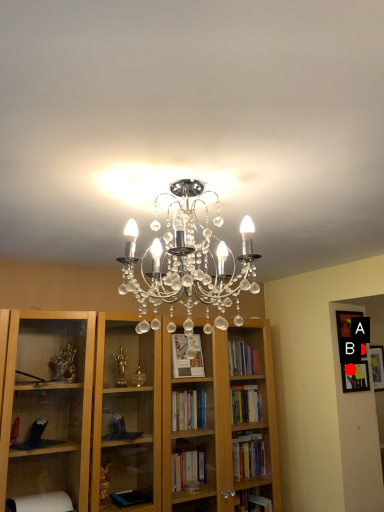
Question: Two points are circled on the image, labeled by A and B beside each circle. Which point appears closest to the camera in this image?

Choices:
 (A) A is closer
 (B) B is closer

Answer: (B)